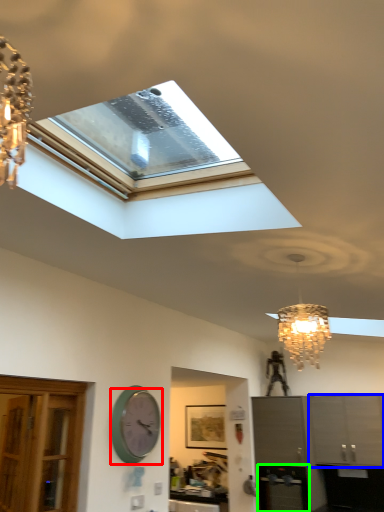
Question: Which object is the farthest from wall clock (highlighted by a red box)? Choose among these: cabinetry (highlighted by a blue box) or appliance (highlighted by a green box).

Choices:
 (A) cabinetry
 (B) appliance

Answer: (A)